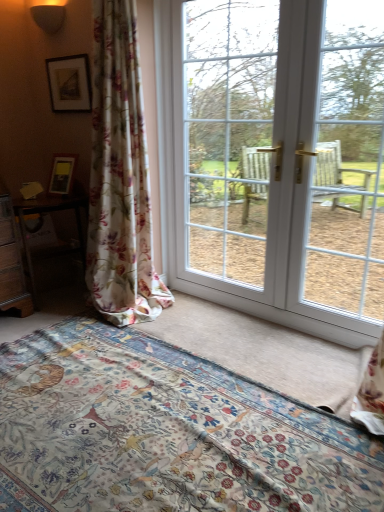
Question: Is floral fabric bed at lower center at the back of floral fabric curtain at left?

Choices:
 (A) no
 (B) yes

Answer: (A)

Question: Is floral fabric curtain at left positioned far away from floral fabric bed at lower center?

Choices:
 (A) yes
 (B) no

Answer: (B)

Question: From the image's perspective, is floral fabric curtain at left located above floral fabric bed at lower center?

Choices:
 (A) yes
 (B) no

Answer: (A)

Question: Considering the relative sizes of floral fabric curtain at left and floral fabric bed at lower center in the image provided, is floral fabric curtain at left bigger than floral fabric bed at lower center?

Choices:
 (A) no
 (B) yes

Answer: (B)

Question: Is floral fabric curtain at left facing towards floral fabric bed at lower center?

Choices:
 (A) no
 (B) yes

Answer: (A)

Question: Is floral fabric bed at lower center inside floral fabric curtain at left?

Choices:
 (A) yes
 (B) no

Answer: (B)

Question: Can you confirm if matte black picture frame at upper left is positioned to the right of floral fabric curtain at left?

Choices:
 (A) no
 (B) yes

Answer: (A)

Question: Considering the relative positions of matte black picture frame at upper left and floral fabric curtain at left in the image provided, is matte black picture frame at upper left to the left of floral fabric curtain at left from the viewer's perspective?

Choices:
 (A) yes
 (B) no

Answer: (A)

Question: Is the position of matte black picture frame at upper left more distant than that of floral fabric curtain at left?

Choices:
 (A) yes
 (B) no

Answer: (A)

Question: From a real-world perspective, is matte black picture frame at upper left located beneath floral fabric curtain at left?

Choices:
 (A) yes
 (B) no

Answer: (B)

Question: Would you consider matte black picture frame at upper left to be distant from floral fabric curtain at left?

Choices:
 (A) no
 (B) yes

Answer: (A)

Question: From a real-world perspective, is matte black picture frame at upper left on top of floral fabric curtain at left?

Choices:
 (A) no
 (B) yes

Answer: (B)

Question: Does white glass window at center, the 2th window screen when ordered from right to left, come in front of matte black picture frame at upper left?

Choices:
 (A) no
 (B) yes

Answer: (B)